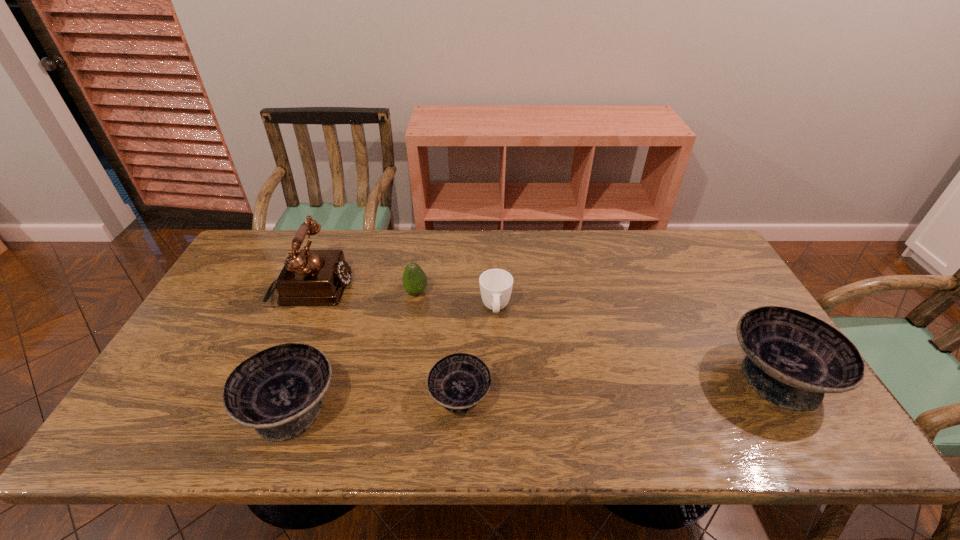
This screenshot has height=540, width=960. I want to click on the leftmost bowl, so click(278, 391).

Where is `the shortest object`? the shortest object is located at coordinates (458, 382).

I want to click on the shortest bowl, so click(458, 382).

Locate an element on the screen. The width and height of the screenshot is (960, 540). the rightmost bowl is located at coordinates (793, 359).

Where is `avocado`? The height and width of the screenshot is (540, 960). avocado is located at coordinates (414, 279).

The height and width of the screenshot is (540, 960). I want to click on the tallest object, so click(x=309, y=277).

Identify the location of cup. Image resolution: width=960 pixels, height=540 pixels. (496, 285).

Identify the location of free space located 0.270m on the right of the second shortest bowl. (453, 407).

What are the coordinates of `free space located 0.350m on the left of the shortest bowl` in the screenshot? It's located at (283, 396).

Image resolution: width=960 pixels, height=540 pixels. Find the location of `vacant space situated 0.240m on the back of the rightmost bowl`. vacant space situated 0.240m on the back of the rightmost bowl is located at coordinates (717, 279).